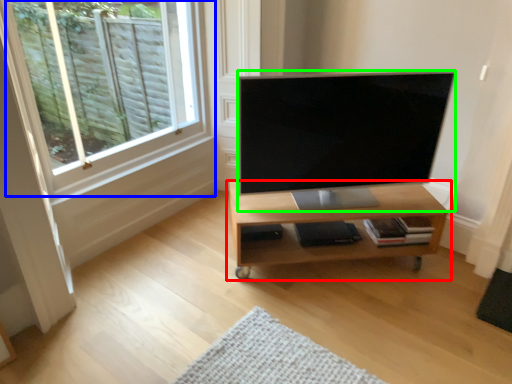
Question: Which object is positioned closest to shelf (highlighted by a red box)? Select from window (highlighted by a blue box) and television (highlighted by a green box).

Choices:
 (A) window
 (B) television

Answer: (B)